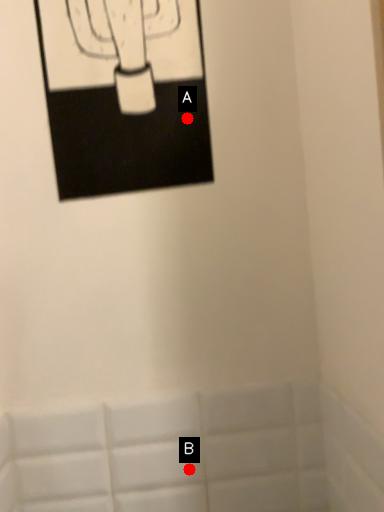
Question: Two points are circled on the image, labeled by A and B beside each circle. Which point is closer to the camera?

Choices:
 (A) A is closer
 (B) B is closer

Answer: (A)